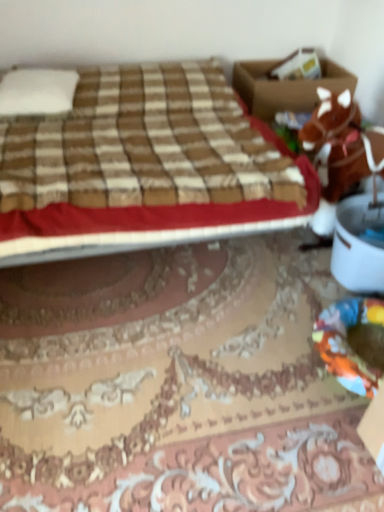
Question: Is white soft pillow at upper left with brown cardboard box at upper right?

Choices:
 (A) yes
 (B) no

Answer: (B)

Question: Does white soft pillow at upper left come in front of brown cardboard box at upper right?

Choices:
 (A) no
 (B) yes

Answer: (B)

Question: Is white soft pillow at upper left bigger than brown cardboard box at upper right?

Choices:
 (A) yes
 (B) no

Answer: (B)

Question: Is white soft pillow at upper left outside of brown cardboard box at upper right?

Choices:
 (A) yes
 (B) no

Answer: (A)

Question: Are white soft pillow at upper left and brown cardboard box at upper right far apart?

Choices:
 (A) yes
 (B) no

Answer: (A)

Question: From the image's perspective, is white soft pillow at upper left over brown cardboard box at upper right?

Choices:
 (A) no
 (B) yes

Answer: (A)

Question: Is the depth of brown cardboard box at upper right less than that of white soft pillow at upper left?

Choices:
 (A) no
 (B) yes

Answer: (A)

Question: Can you confirm if brown cardboard box at upper right is thinner than white soft pillow at upper left?

Choices:
 (A) no
 (B) yes

Answer: (B)

Question: Is brown cardboard box at upper right placed right next to white soft pillow at upper left?

Choices:
 (A) yes
 (B) no

Answer: (B)

Question: From a real-world perspective, does brown cardboard box at upper right sit lower than white soft pillow at upper left?

Choices:
 (A) no
 (B) yes

Answer: (B)

Question: Considering the relative positions of brown cardboard box at upper right and white soft pillow at upper left in the image provided, is brown cardboard box at upper right to the left of white soft pillow at upper left from the viewer's perspective?

Choices:
 (A) no
 (B) yes

Answer: (A)

Question: Could you tell me if brown cardboard box at upper right is turned towards white soft pillow at upper left?

Choices:
 (A) yes
 (B) no

Answer: (B)

Question: Can you confirm if brown plush horse at right is wider than white soft pillow at upper left?

Choices:
 (A) yes
 (B) no

Answer: (B)